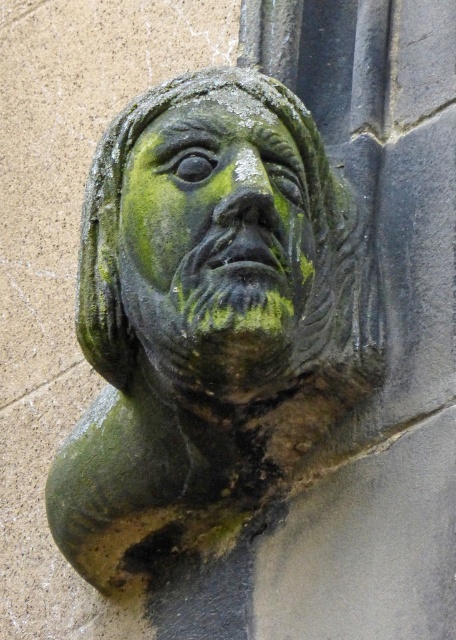
Question: Is the position of green stone bust at center more distant than that of green stone face at center?

Choices:
 (A) yes
 (B) no

Answer: (A)

Question: Does green stone bust at center have a smaller size compared to green stone face at center?

Choices:
 (A) no
 (B) yes

Answer: (A)

Question: Which point is closer to the camera?

Choices:
 (A) (217, 106)
 (B) (197, 492)

Answer: (A)

Question: In this image, where is green stone bust at center located relative to green stone face at center?

Choices:
 (A) below
 (B) above

Answer: (A)